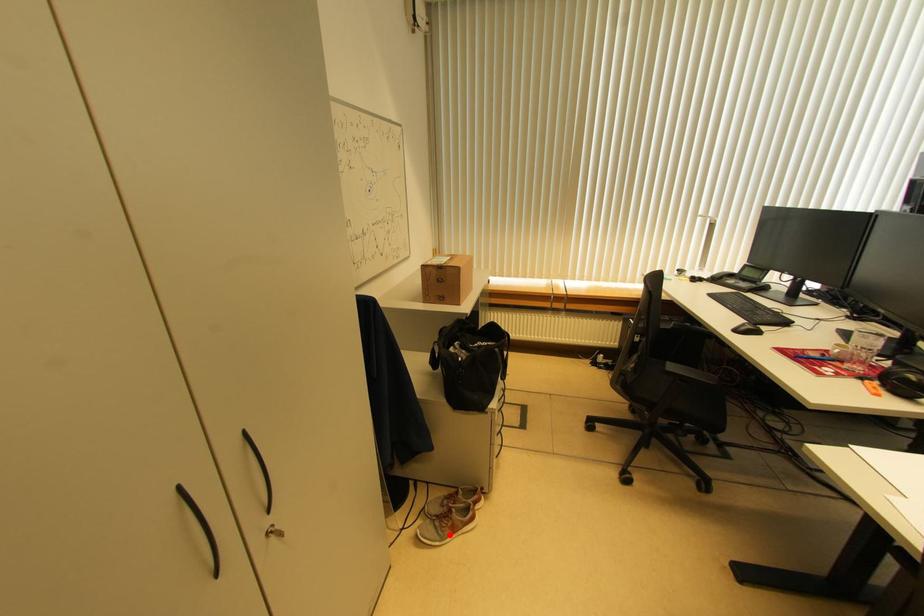
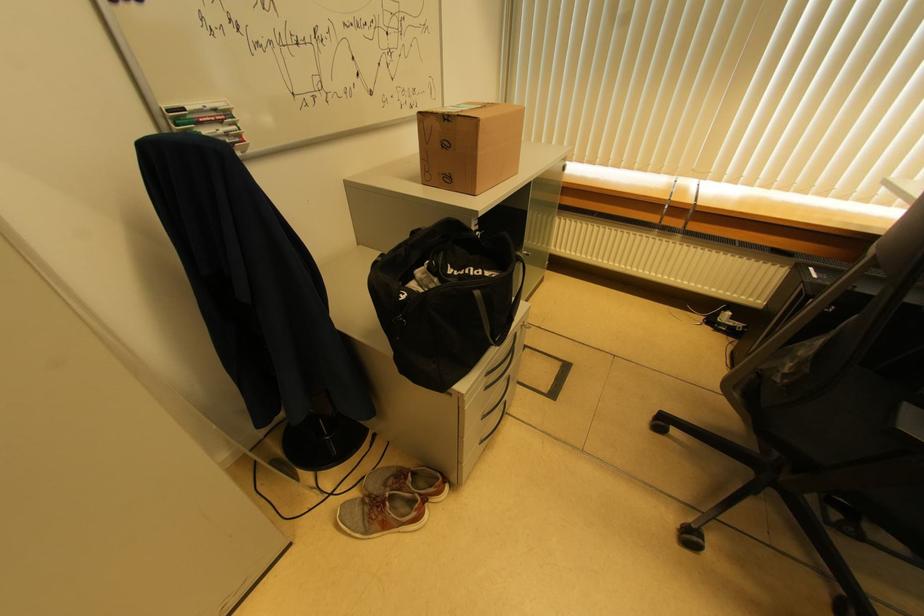
The point at the highlighted location is marked in the first image. Where is the corresponding point in the second image?

(379, 529)